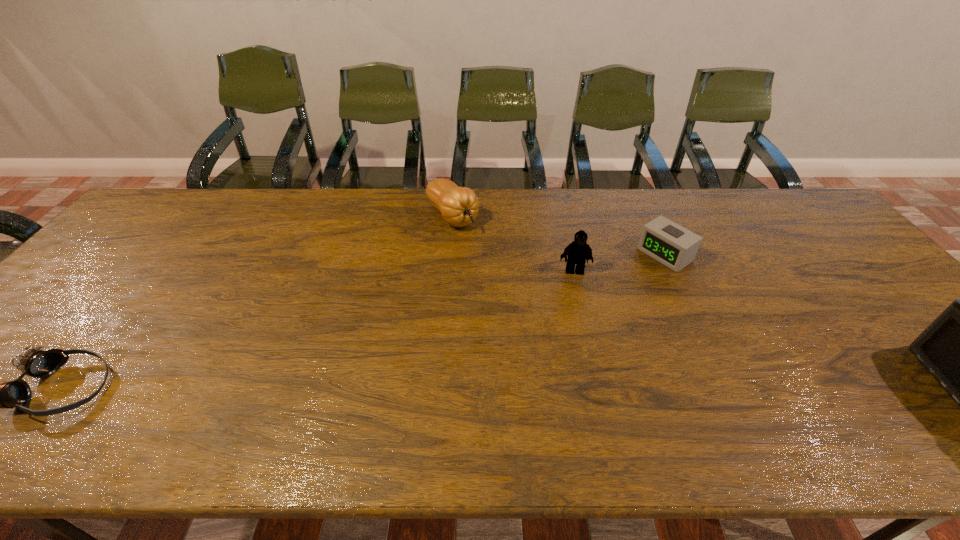
What are the coordinates of `free space on the desktop that is between the goggles and the rightmost object and is positioned on the stem side of the second object from left to right` in the screenshot? It's located at (635, 393).

Where is `free space on the desktop that is between the goggles and the camera and is positioned on the face of the Lego`? free space on the desktop that is between the goggles and the camera and is positioned on the face of the Lego is located at coordinates (585, 393).

The width and height of the screenshot is (960, 540). What are the coordinates of `free spot on the desktop that is between the leftmost object and the tallest object and is positioned on the front-facing side of the fourth object from left to right` in the screenshot? It's located at (458, 392).